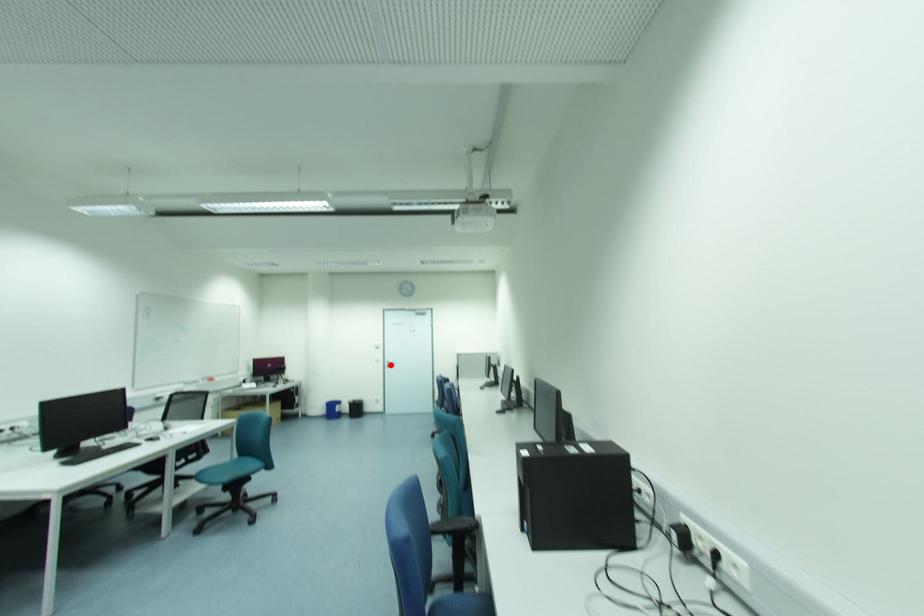
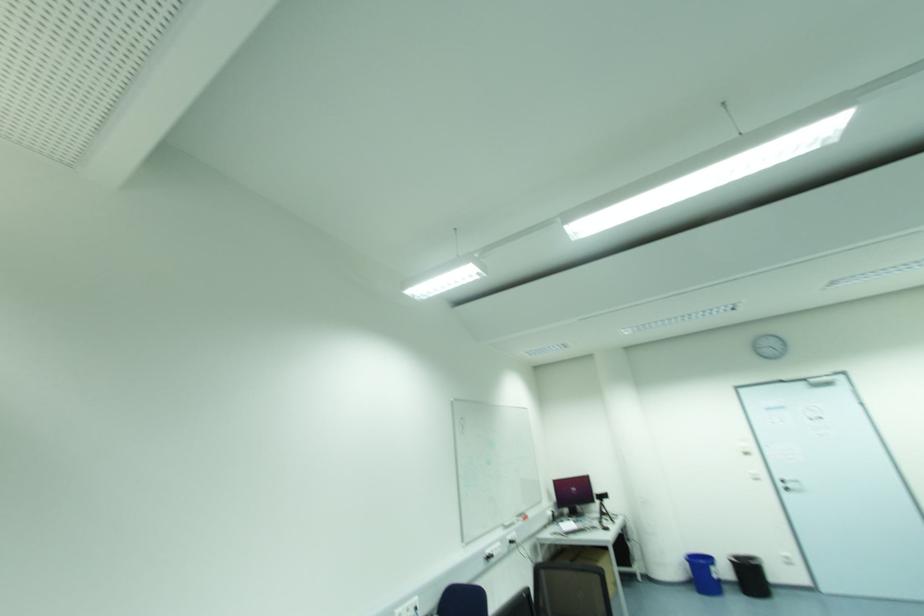
Question: I am providing you with two images of the same scene from different viewpoints. A red point is shown in image1. For the corresponding object point in image2, is it positioned nearer or farther from the camera?

Choices:
 (A) Nearer
 (B) Farther

Answer: (A)